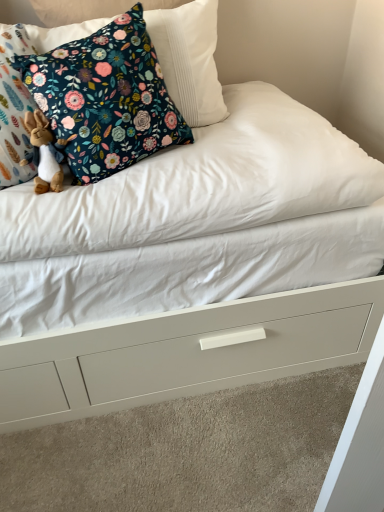
Question: Are brown plush rabbit at left and floral fabric pillow at upper left far apart?

Choices:
 (A) no
 (B) yes

Answer: (A)

Question: Is brown plush rabbit at left oriented towards floral fabric pillow at upper left?

Choices:
 (A) yes
 (B) no

Answer: (A)

Question: Does brown plush rabbit at left lie in front of floral fabric pillow at upper left?

Choices:
 (A) no
 (B) yes

Answer: (A)

Question: Does brown plush rabbit at left have a greater width compared to floral fabric pillow at upper left?

Choices:
 (A) no
 (B) yes

Answer: (A)

Question: Does brown plush rabbit at left touch floral fabric pillow at upper left?

Choices:
 (A) yes
 (B) no

Answer: (B)

Question: From the image's perspective, is brown plush rabbit at left located above or below floral fabric pillow at upper left?

Choices:
 (A) below
 (B) above

Answer: (A)

Question: From a real-world perspective, relative to floral fabric pillow at upper left, is brown plush rabbit at left vertically above or below?

Choices:
 (A) above
 (B) below

Answer: (B)

Question: Is brown plush rabbit at left to the left or to the right of floral fabric pillow at upper left in the image?

Choices:
 (A) left
 (B) right

Answer: (A)

Question: Looking at their shapes, would you say brown plush rabbit at left is wider or thinner than floral fabric pillow at upper left?

Choices:
 (A) wide
 (B) thin

Answer: (B)

Question: Considering the positions of white matte drawer at center and brown plush rabbit at left in the image, is white matte drawer at center taller or shorter than brown plush rabbit at left?

Choices:
 (A) short
 (B) tall

Answer: (A)

Question: In the image, is white matte drawer at center on the left side or the right side of brown plush rabbit at left?

Choices:
 (A) right
 (B) left

Answer: (A)

Question: From the image's perspective, is white matte drawer at center above or below brown plush rabbit at left?

Choices:
 (A) above
 (B) below

Answer: (B)

Question: Considering their positions, is white matte drawer at center located in front of or behind brown plush rabbit at left?

Choices:
 (A) behind
 (B) front

Answer: (A)

Question: Looking at their shapes, would you say floral fabric pillow at upper left is wider or thinner than brown plush rabbit at left?

Choices:
 (A) thin
 (B) wide

Answer: (B)

Question: Considering the positions of floral fabric pillow at upper left and brown plush rabbit at left in the image, is floral fabric pillow at upper left bigger or smaller than brown plush rabbit at left?

Choices:
 (A) small
 (B) big

Answer: (B)